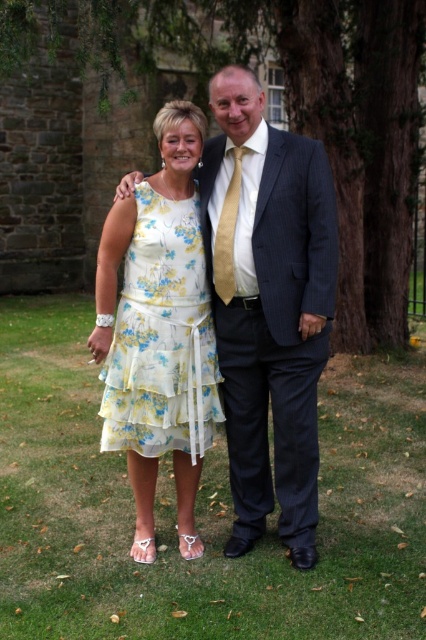
Question: Which of these objects is positioned closest to the dark blue pinstripe suit at center?

Choices:
 (A) floral cotton dress at center
 (B) brown textured tree trunk at center right
 (C) gold silk tie at center

Answer: (A)

Question: Among these points, which one is farthest from the camera?

Choices:
 (A) (302, 141)
 (B) (106, 381)

Answer: (B)

Question: Is dark blue pinstripe suit at center thinner than gold silk tie at center?

Choices:
 (A) no
 (B) yes

Answer: (A)

Question: Does dark blue pinstripe suit at center appear on the left side of floral cotton dress at center?

Choices:
 (A) no
 (B) yes

Answer: (A)

Question: Among these points, which one is nearest to the camera?

Choices:
 (A) (230, 285)
 (B) (106, 387)
 (C) (365, 324)

Answer: (A)

Question: Is the position of brown textured tree trunk at center right less distant than that of dark blue pinstripe suit at center?

Choices:
 (A) yes
 (B) no

Answer: (B)